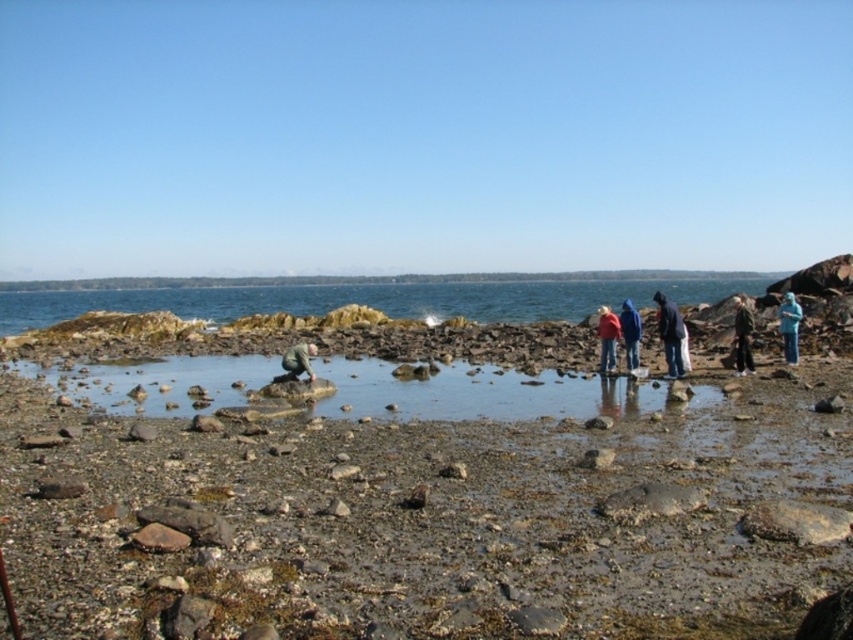
Question: Does dark blue jacket at right have a greater width compared to dark brown leather jacket at right?

Choices:
 (A) yes
 (B) no

Answer: (B)

Question: Which of the following is the farthest from the observer?

Choices:
 (A) (614, 330)
 (B) (303, 355)

Answer: (A)

Question: Among these objects, which one is farthest from the camera?

Choices:
 (A) blue fabric jacket at center
 (B) dark brown leather jacket at right
 (C) blue water at center
 (D) green fabric jacket at lower left

Answer: (C)

Question: Based on their relative distances, which object is farther from the smooth pebbles at center?

Choices:
 (A) blue denim jacket at center
 (B) blue water at center
 (C) blue fabric jacket at lower right
 (D) dark blue jacket at right

Answer: (B)

Question: Does dark blue jacket at right lie behind blue fabric jacket at center?

Choices:
 (A) yes
 (B) no

Answer: (B)

Question: Is blue fabric jacket at lower right smaller than blue denim jacket at center?

Choices:
 (A) no
 (B) yes

Answer: (B)